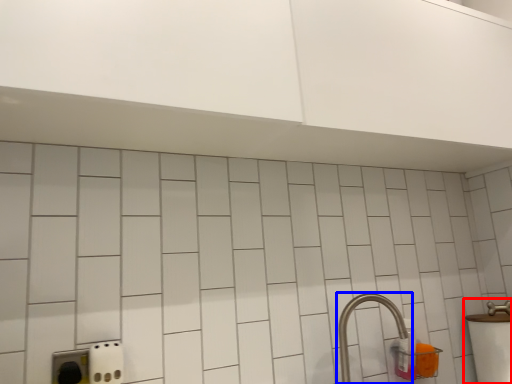
Question: Which object is further to the camera taking this photo, sink (highlighted by a red box) or tap (highlighted by a blue box)?

Choices:
 (A) sink
 (B) tap

Answer: (A)